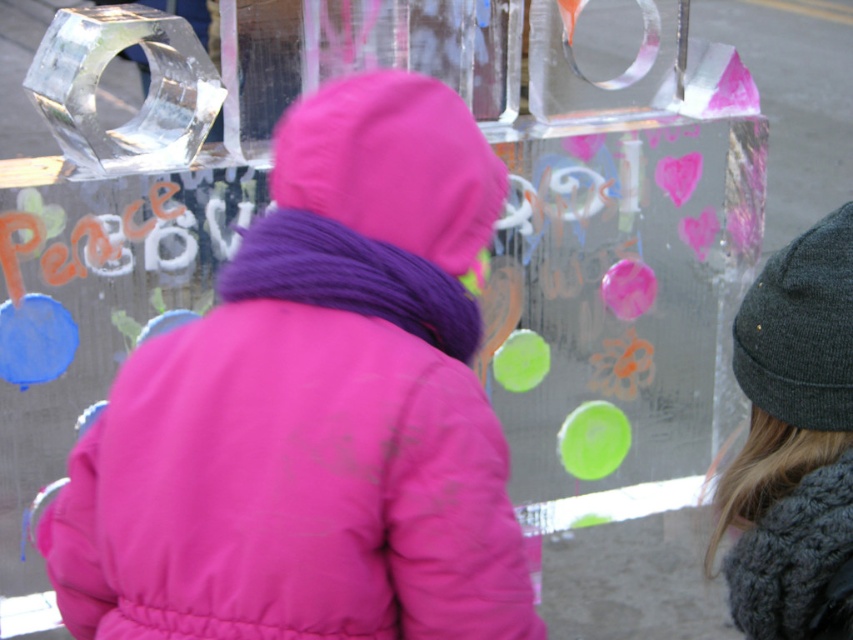
Where is `pink matte jacket at center`? Image resolution: width=853 pixels, height=640 pixels. pink matte jacket at center is located at coordinates (314, 410).

Image resolution: width=853 pixels, height=640 pixels. What do you see at coordinates (314, 410) in the screenshot?
I see `pink matte jacket at center` at bounding box center [314, 410].

Locate an element on the screen. pink matte jacket at center is located at coordinates (314, 410).